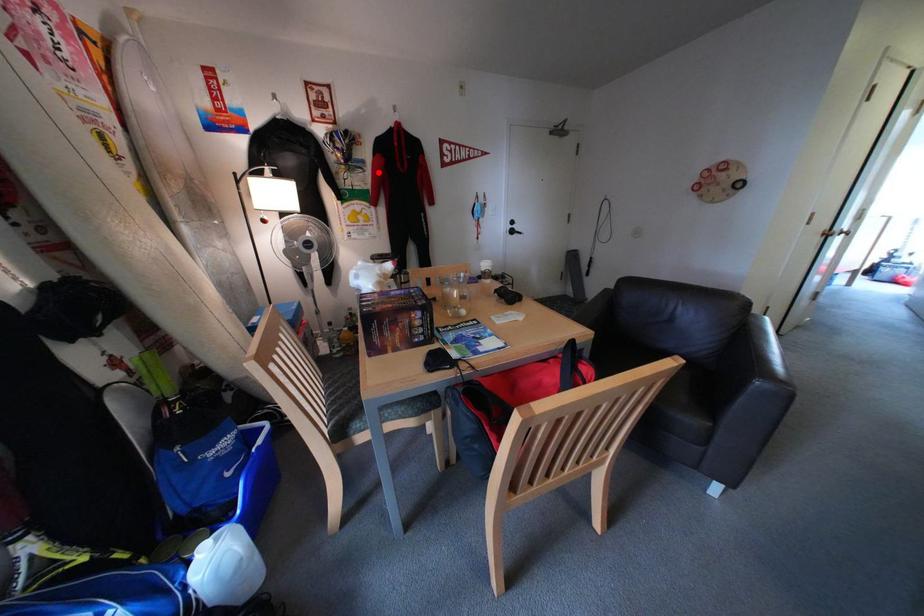
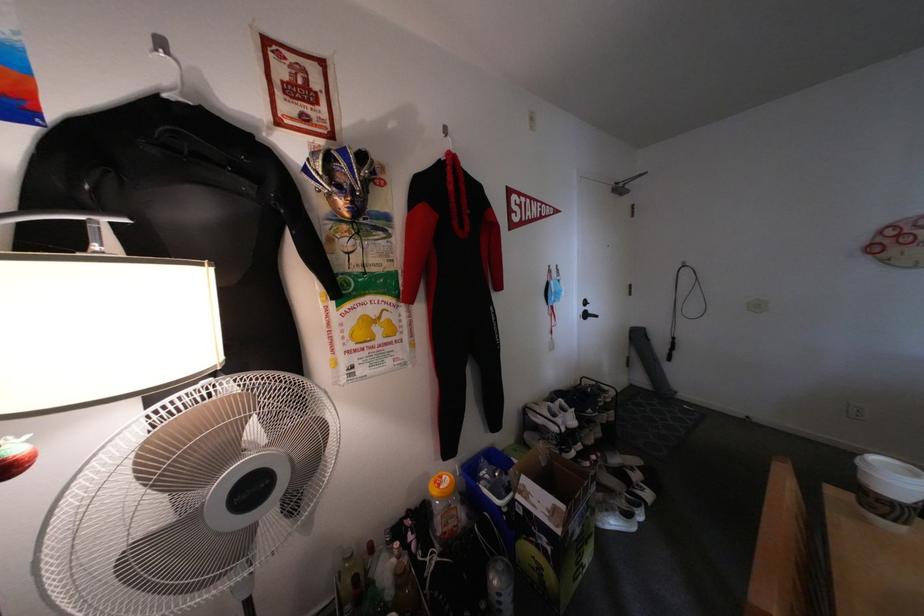
The point at the highlighted location is marked in the first image. Where is the corresponding point in the second image?

(404, 237)